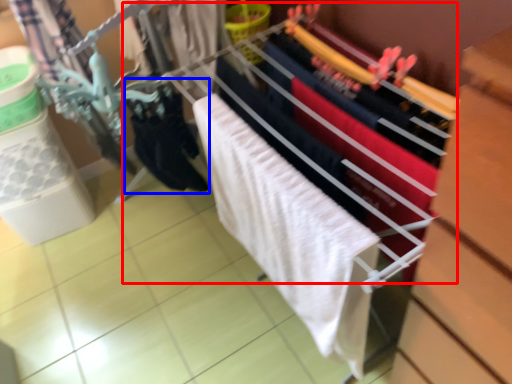
Question: Which object appears farthest to the camera in this image, closet (highlighted by a red box) or clothing (highlighted by a blue box)?

Choices:
 (A) closet
 (B) clothing

Answer: (B)